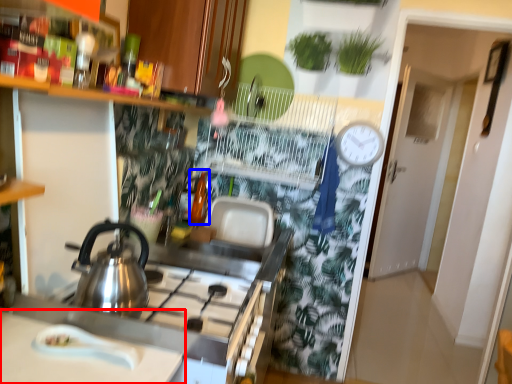
Question: Which point is closer to the camera, countertop (highlighted by a red box) or bottle (highlighted by a blue box)?

Choices:
 (A) countertop
 (B) bottle

Answer: (A)